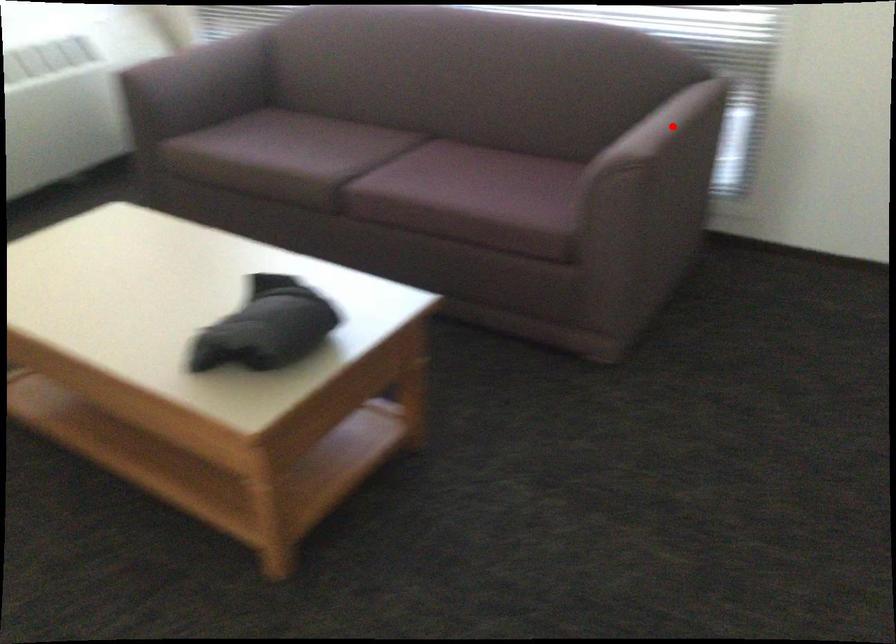
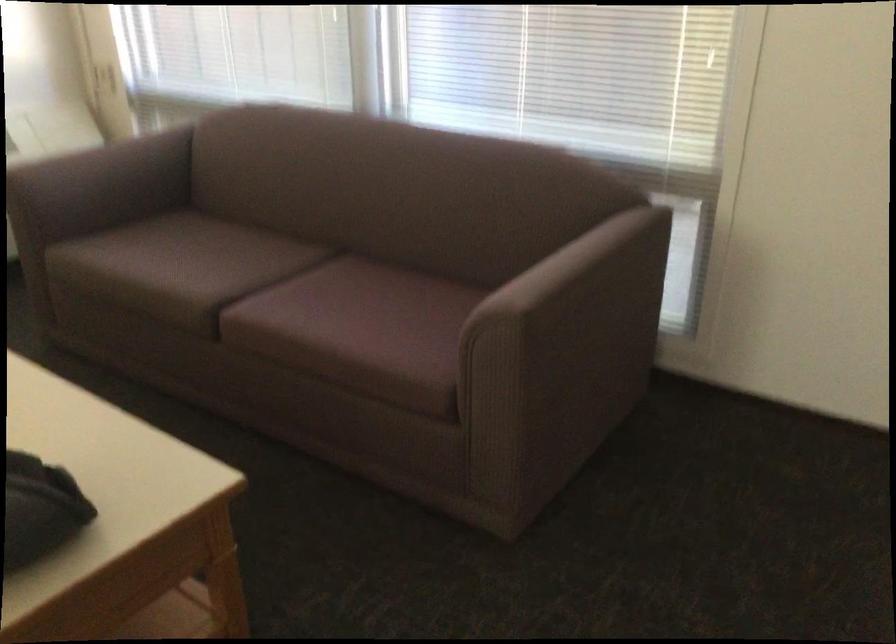
The point at the highlighted location is marked in the first image. Where is the corresponding point in the second image?

(579, 265)